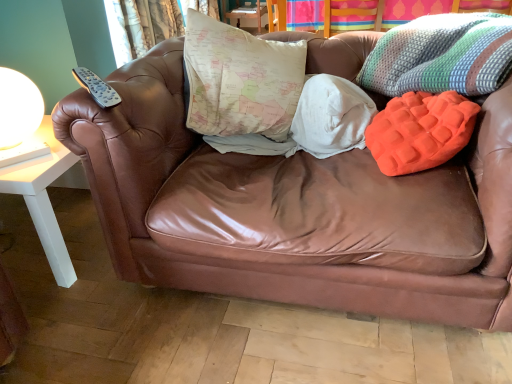
Question: Is knitted multicolored throw pillow at upper right behind orange textured pillow at right, the first pillow viewed from the right?

Choices:
 (A) no
 (B) yes

Answer: (A)

Question: Does knitted multicolored throw pillow at upper right have a larger size compared to orange textured pillow at right, the first pillow viewed from the right?

Choices:
 (A) yes
 (B) no

Answer: (A)

Question: From a real-world perspective, is knitted multicolored throw pillow at upper right positioned over orange textured pillow at right, acting as the second pillow starting from the left, based on gravity?

Choices:
 (A) yes
 (B) no

Answer: (A)

Question: From a real-world perspective, is knitted multicolored throw pillow at upper right under orange textured pillow at right, acting as the second pillow starting from the left?

Choices:
 (A) no
 (B) yes

Answer: (A)

Question: From the image's perspective, is knitted multicolored throw pillow at upper right above orange textured pillow at right, the first pillow viewed from the right?

Choices:
 (A) no
 (B) yes

Answer: (B)

Question: Can you confirm if knitted multicolored throw pillow at upper right is taller than orange textured pillow at right, the first pillow viewed from the right?

Choices:
 (A) no
 (B) yes

Answer: (B)

Question: Does orange textured pillow at right, the first pillow viewed from the right, appear on the right side of map-patterned fabric pillow at center, the second pillow when ordered from right to left?

Choices:
 (A) no
 (B) yes

Answer: (B)

Question: Is the depth of orange textured pillow at right, acting as the second pillow starting from the left, less than that of map-patterned fabric pillow at center, which ranks as the 1th pillow in left-to-right order?

Choices:
 (A) no
 (B) yes

Answer: (B)

Question: Is orange textured pillow at right, acting as the second pillow starting from the left, wider than map-patterned fabric pillow at center, the second pillow when ordered from right to left?

Choices:
 (A) no
 (B) yes

Answer: (A)

Question: Is orange textured pillow at right, acting as the second pillow starting from the left, facing away from map-patterned fabric pillow at center, which ranks as the 1th pillow in left-to-right order?

Choices:
 (A) yes
 (B) no

Answer: (B)

Question: Is map-patterned fabric pillow at center, the second pillow when ordered from right to left, a part of orange textured pillow at right, the first pillow viewed from the right?

Choices:
 (A) no
 (B) yes

Answer: (A)

Question: Is orange textured pillow at right, acting as the second pillow starting from the left, directly adjacent to map-patterned fabric pillow at center, which ranks as the 1th pillow in left-to-right order?

Choices:
 (A) yes
 (B) no

Answer: (B)

Question: From the image's perspective, is textured fabric curtain at upper left on top of map-patterned fabric pillow at center, which ranks as the 1th pillow in left-to-right order?

Choices:
 (A) no
 (B) yes

Answer: (B)